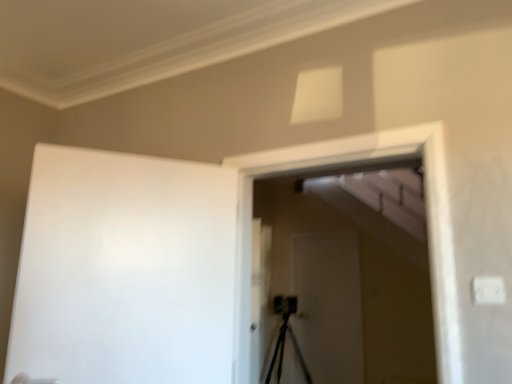
Question: Is white matte screen door at center, which appears as the first screen door when viewed from the back, turned away from white matte barn door at left?

Choices:
 (A) no
 (B) yes

Answer: (A)

Question: From the image's perspective, is white matte screen door at center, the second screen door viewed from the front, located above white matte barn door at left?

Choices:
 (A) no
 (B) yes

Answer: (A)

Question: Can you confirm if white matte screen door at center, which appears as the first screen door when viewed from the back, is thinner than white matte barn door at left?

Choices:
 (A) no
 (B) yes

Answer: (B)

Question: Is white matte screen door at center, the second screen door viewed from the front, wider than white matte barn door at left?

Choices:
 (A) no
 (B) yes

Answer: (A)

Question: From the image's perspective, is white matte screen door at center, the second screen door viewed from the front, located beneath white matte barn door at left?

Choices:
 (A) yes
 (B) no

Answer: (A)

Question: Is white matte screen door at center, which appears as the first screen door when viewed from the back, to the right of white matte barn door at left from the viewer's perspective?

Choices:
 (A) no
 (B) yes

Answer: (B)

Question: Is white matte barn door at left positioned beyond the bounds of white matte screen door at center, which appears as the first screen door when viewed from the back?

Choices:
 (A) no
 (B) yes

Answer: (B)

Question: Considering the relative sizes of white matte barn door at left and white matte screen door at center, which appears as the first screen door when viewed from the back, in the image provided, is white matte barn door at left taller than white matte screen door at center, which appears as the first screen door when viewed from the back,?

Choices:
 (A) no
 (B) yes

Answer: (A)

Question: From the image's perspective, would you say white matte barn door at left is positioned over white matte screen door at center, which appears as the first screen door when viewed from the back?

Choices:
 (A) no
 (B) yes

Answer: (B)

Question: Is white matte barn door at left looking in the opposite direction of white matte screen door at center, the second screen door viewed from the front?

Choices:
 (A) yes
 (B) no

Answer: (B)

Question: Can you see white matte barn door at left touching white matte screen door at center, the second screen door viewed from the front?

Choices:
 (A) no
 (B) yes

Answer: (A)

Question: Is white matte barn door at left to the left of white matte screen door at center, the second screen door viewed from the front, from the viewer's perspective?

Choices:
 (A) no
 (B) yes

Answer: (B)

Question: Is white matte screen door at center, which appears as the first screen door when viewed from the back, at the right side of white matte screen door at center, the 2th screen door from the back?

Choices:
 (A) yes
 (B) no

Answer: (A)